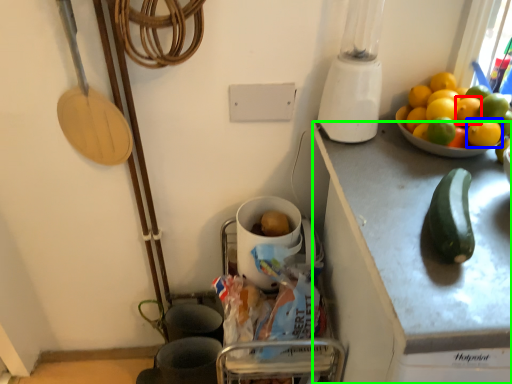
Question: Which is nearer to the lemon (highlighted by a red box)? lemon (highlighted by a blue box) or cabinetry (highlighted by a green box).

Choices:
 (A) lemon
 (B) cabinetry

Answer: (A)